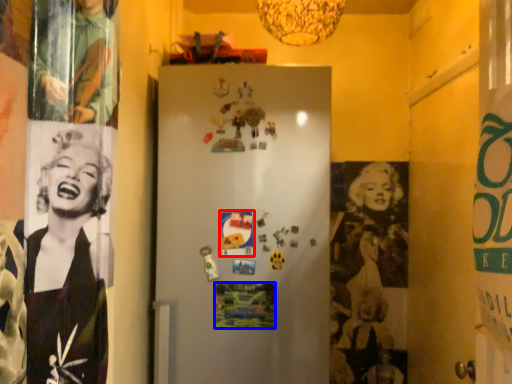
Question: Which object appears closest to the camera in this image, poster page (highlighted by a red box) or poster page (highlighted by a blue box)?

Choices:
 (A) poster page
 (B) poster page

Answer: (A)